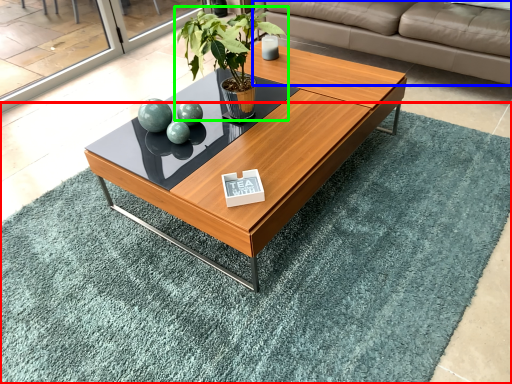
Question: Which is farther away from mat (highlighted by a red box)? studio couch (highlighted by a blue box) or houseplant (highlighted by a green box)?

Choices:
 (A) studio couch
 (B) houseplant

Answer: (A)